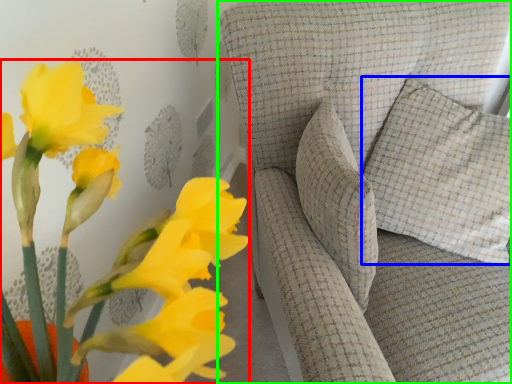
Question: Based on their relative distances, which object is nearer to floral arrangement (highlighted by a red box)? Choose from pillow (highlighted by a blue box) and furniture (highlighted by a green box).

Choices:
 (A) pillow
 (B) furniture

Answer: (B)